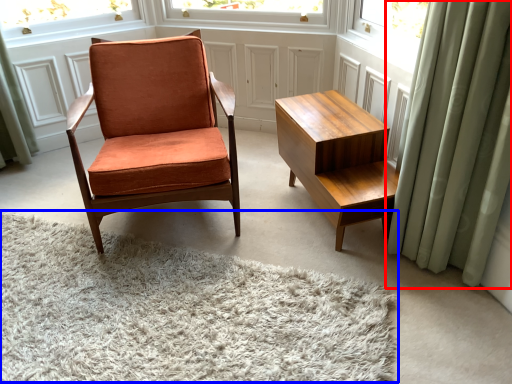
Question: Among these objects, which one is nearest to the camera, curtain (highlighted by a red box) or plain (highlighted by a blue box)?

Choices:
 (A) curtain
 (B) plain

Answer: (B)